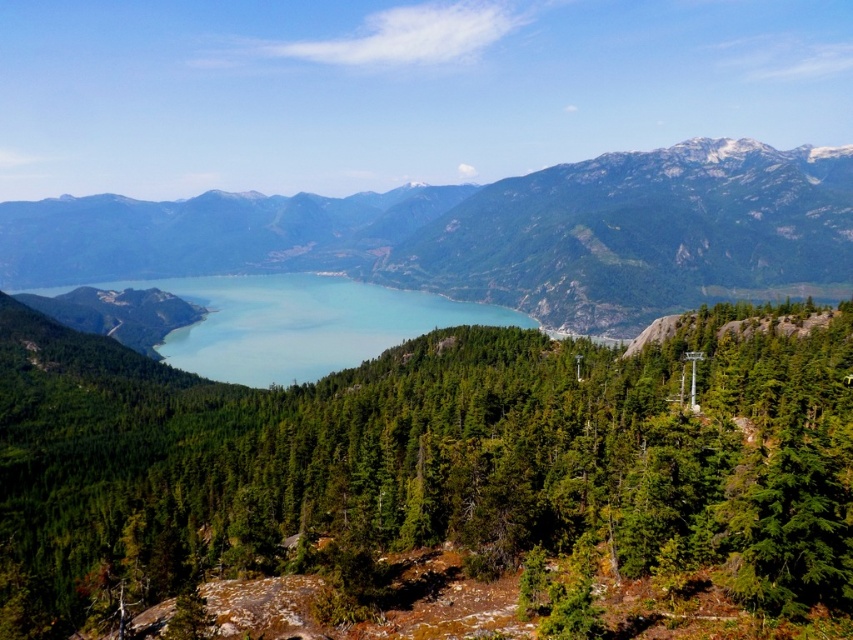
You are standing in the forest and want to reach the blue glassy water at center. Which direction should you move relative to the green textured mountain at center?

You should move away from the green textured mountain at center because it is closer to you than the blue glassy water at center, so moving away from the mountain will bring you closer to the water.

You are a hiker planning to set up a tent between the green matte tree at center and the green textured mountain at center. Considering their widths, which object should you place your tent closer to for better visibility?

The green matte tree at center has a lesser width compared to the green textured mountain at center. Therefore, placing the tent closer to the green matte tree at center would provide better visibility as it is narrower.